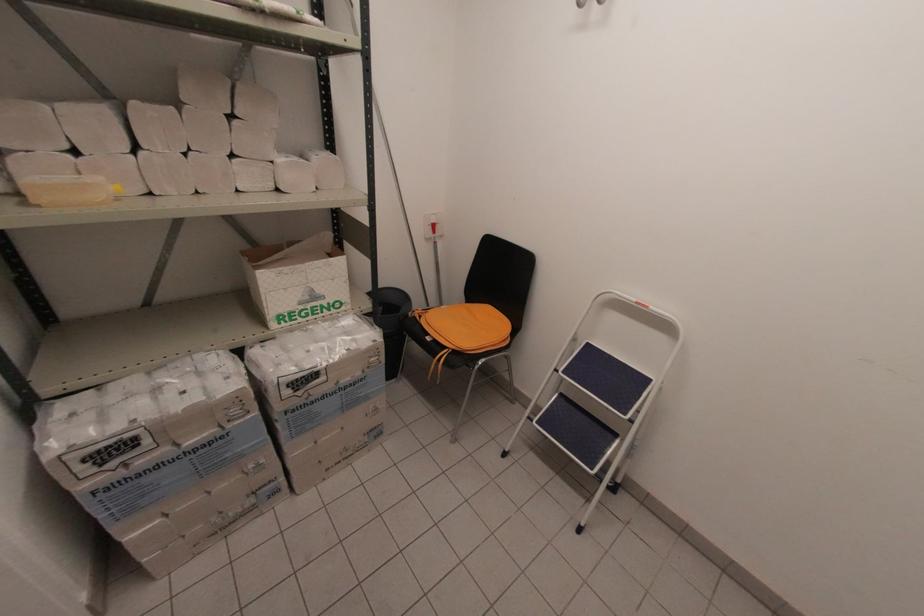
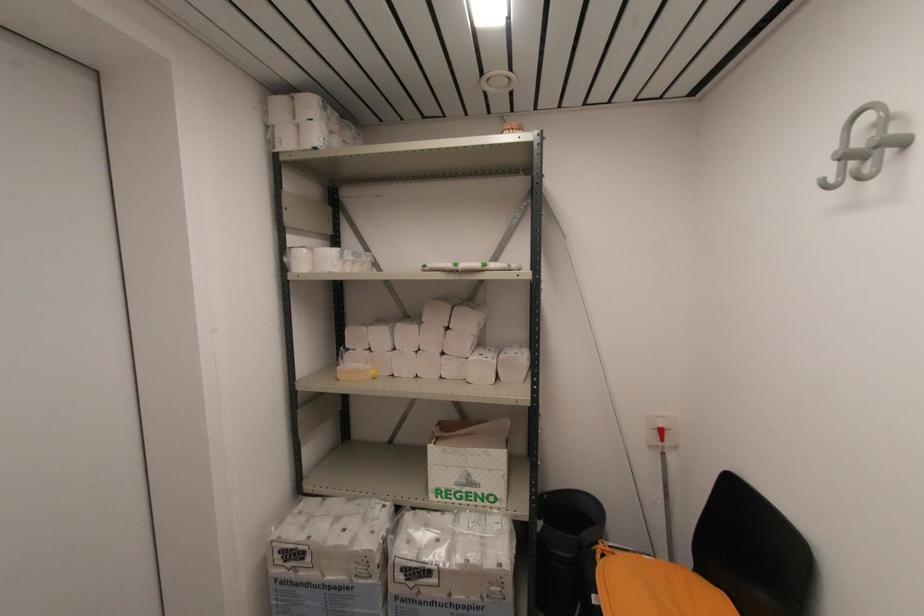
Where in the second image is the point corresponding to the point at 84,463 from the first image?

(281, 553)